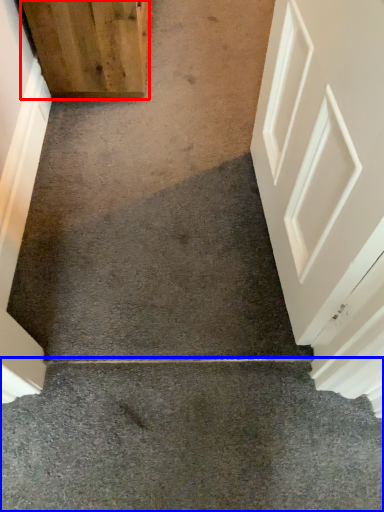
Question: Which point is further to the camera, door (highlighted by a red box) or concrete (highlighted by a blue box)?

Choices:
 (A) door
 (B) concrete

Answer: (A)